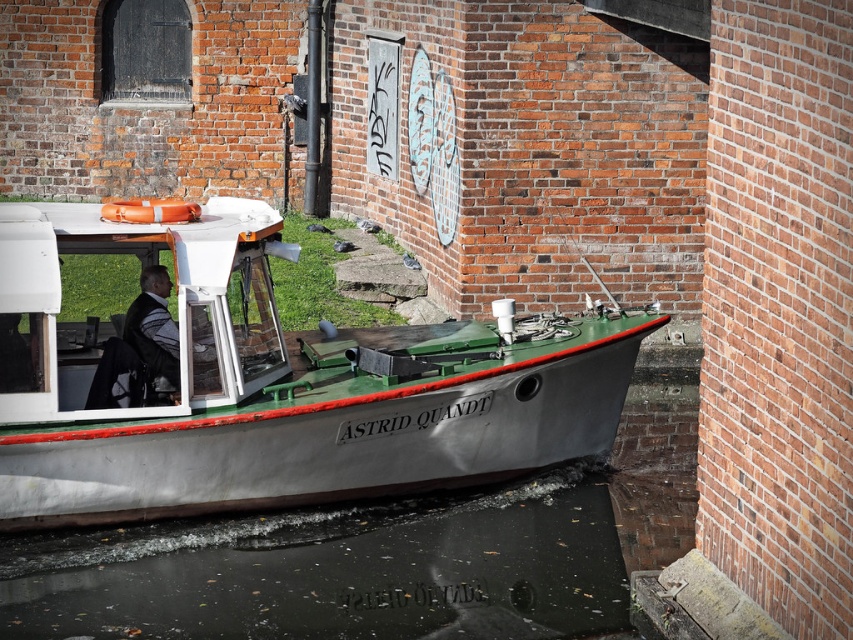
Question: Does green matte boat at center appear under gray fabric jacket at center?

Choices:
 (A) yes
 (B) no

Answer: (A)

Question: Is the position of green matte boat at center more distant than that of gray fabric jacket at center?

Choices:
 (A) no
 (B) yes

Answer: (A)

Question: Which point is closer to the camera?

Choices:
 (A) (59, 417)
 (B) (137, 340)
 (C) (358, 611)

Answer: (C)

Question: Which of the following is the closest to the observer?

Choices:
 (A) dark gray water at lower center
 (B) green matte boat at center

Answer: (A)

Question: Does green matte boat at center come in front of gray fabric jacket at center?

Choices:
 (A) yes
 (B) no

Answer: (A)

Question: Which point is farther from the camera taking this photo?

Choices:
 (A) (161, 301)
 (B) (477, 552)
 (C) (230, 252)

Answer: (A)